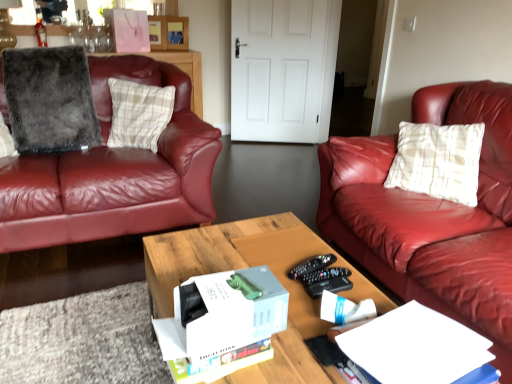
This screenshot has width=512, height=384. What are the coordinates of `free area behind black plastic remote control at center` in the screenshot? It's located at [293, 248].